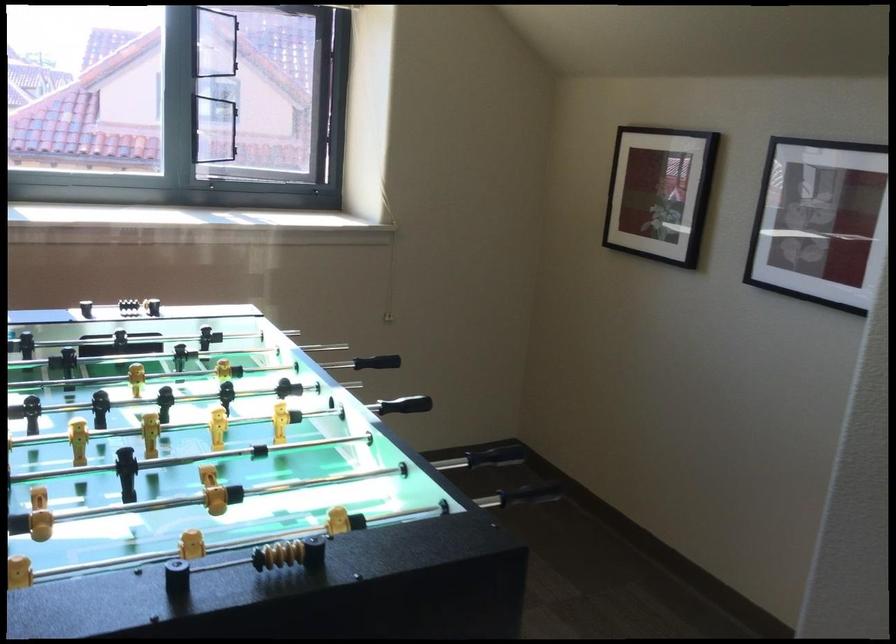
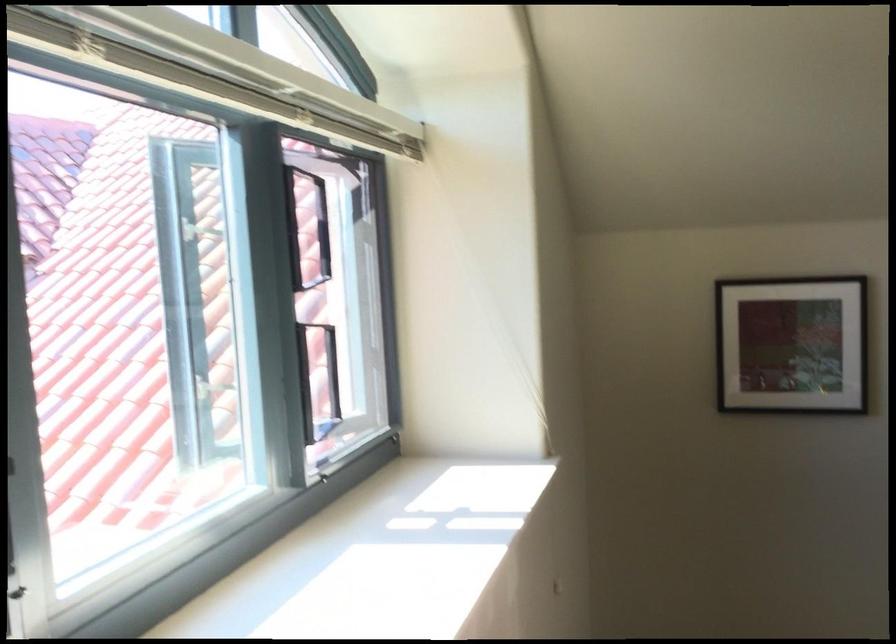
The point at (642, 187) is marked in the first image. Where is the corresponding point in the second image?

(791, 345)